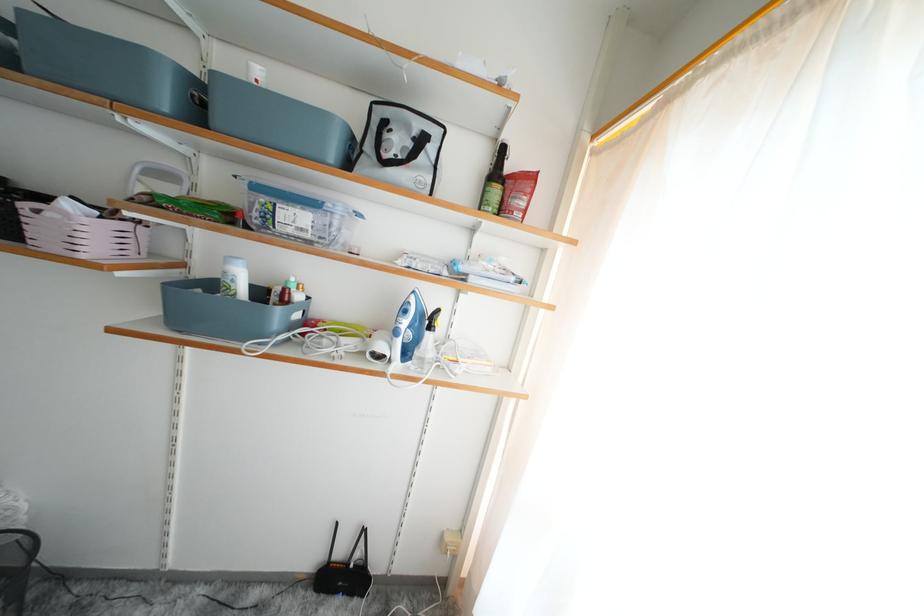
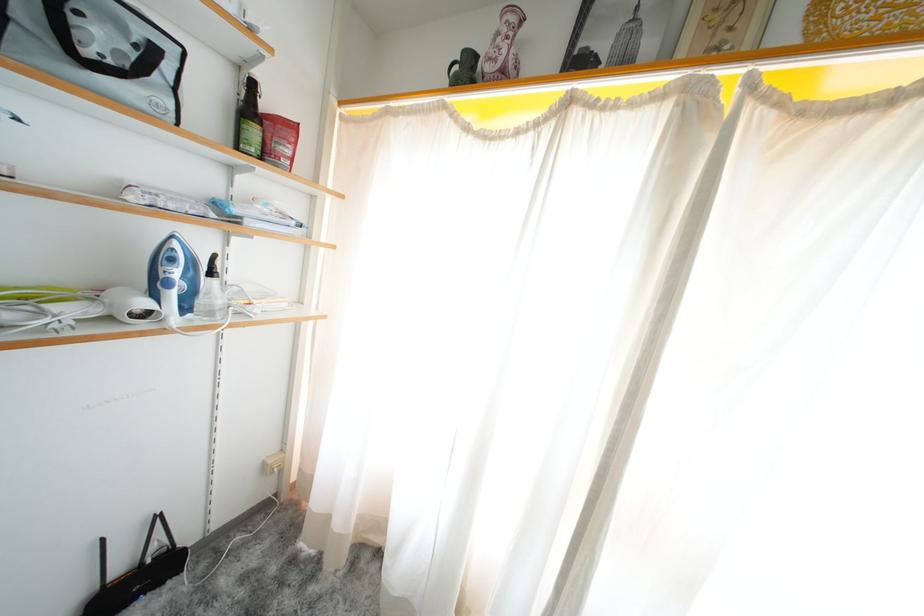
The point at (476, 578) is marked in the first image. Where is the corresponding point in the second image?

(306, 475)